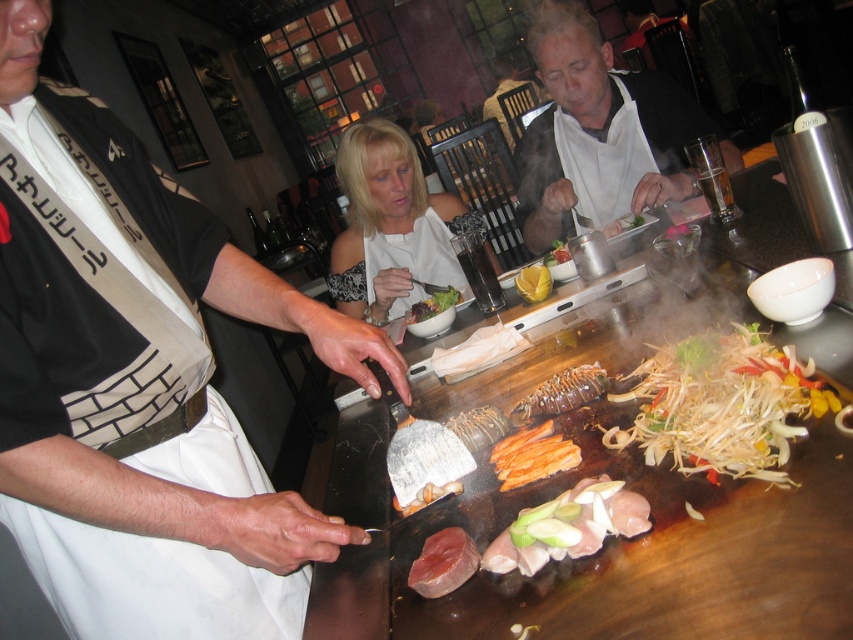
You are a customer at the teppanyaki restaurant and want to place your napkin on the closest object to you. Which object should you choose between the white glossy shirt at upper center and the smooth white plate at center?

The smooth white plate at center is closer to you than the white glossy shirt at upper center, so you should place your napkin on the smooth white plate at center.